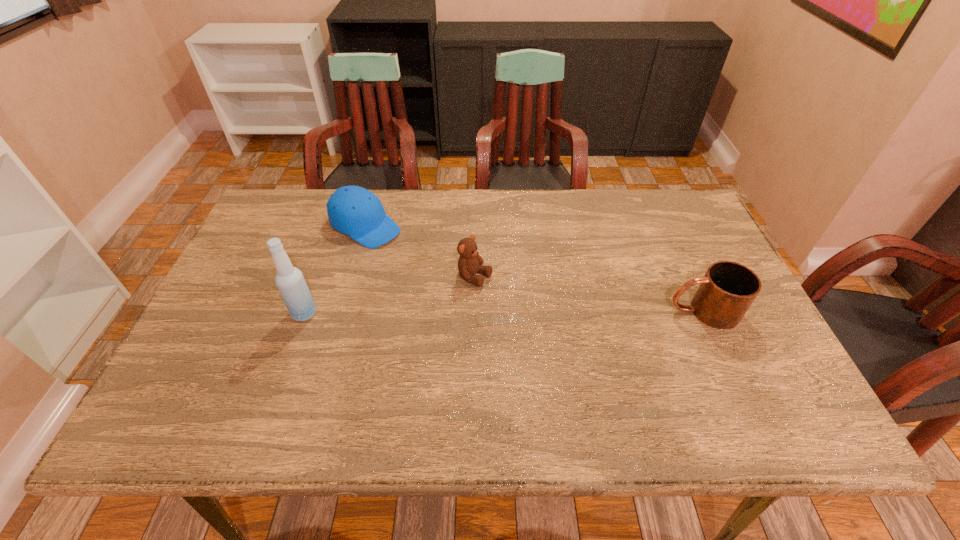
I want to click on bottle, so click(290, 281).

Identify the location of the rightmost object. The height and width of the screenshot is (540, 960). click(727, 290).

Where is `the farthest object`? the farthest object is located at coordinates (352, 210).

Locate an element on the screen. This screenshot has height=540, width=960. the second farthest object is located at coordinates 470,262.

The image size is (960, 540). What are the coordinates of `teddy bear` in the screenshot? It's located at (470, 262).

I want to click on vacant space located on the right of the bottle, so click(408, 313).

Image resolution: width=960 pixels, height=540 pixels. What are the coordinates of `free space located on the side of the mug with the handle` in the screenshot? It's located at (588, 311).

Identify the location of vacant space located 0.110m on the side of the mug with the handle. (624, 311).

Locate an element on the screen. The width and height of the screenshot is (960, 540). blank space located on the side of the mug with the handle is located at coordinates (557, 311).

Find the location of a particular element. free space located on the front-facing side of the farthest object is located at coordinates (414, 255).